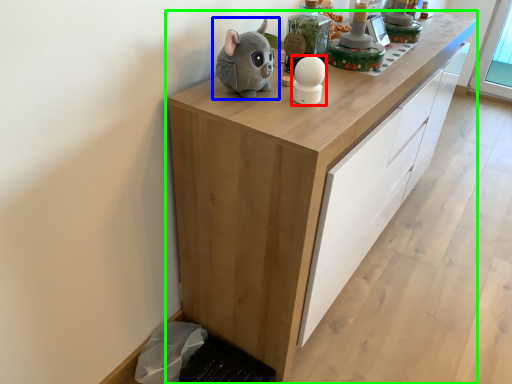
Question: Estimate the real-world distances between objects in this image. Which object is farther from toy (highlighted by a red box), toy (highlighted by a blue box) or cabinetry (highlighted by a green box)?

Choices:
 (A) toy
 (B) cabinetry

Answer: (B)